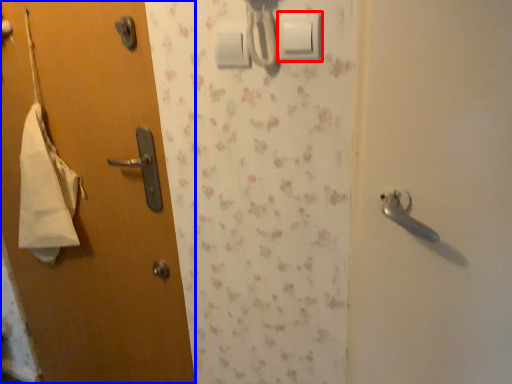
Question: Which point is further to the camera, light switch (highlighted by a red box) or door (highlighted by a blue box)?

Choices:
 (A) light switch
 (B) door

Answer: (B)